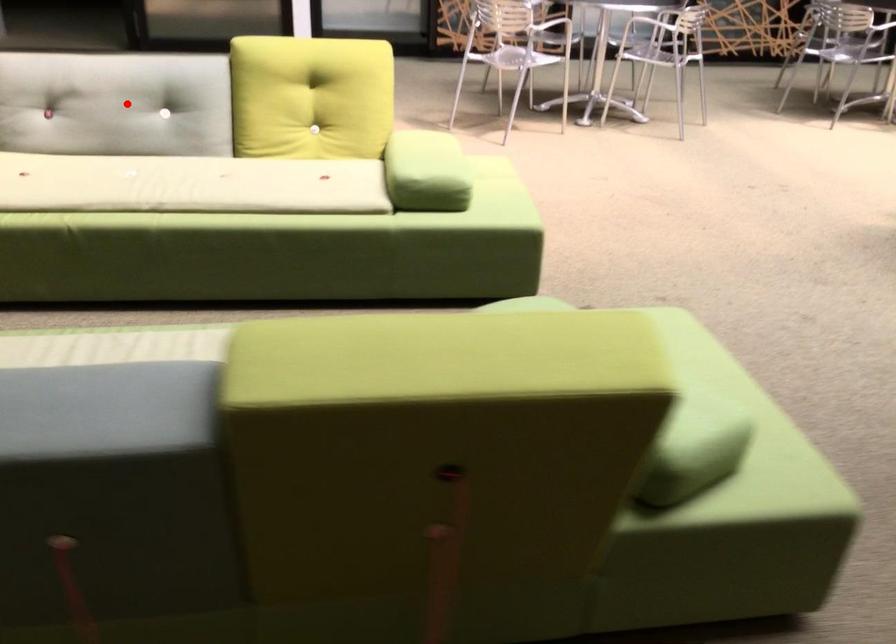
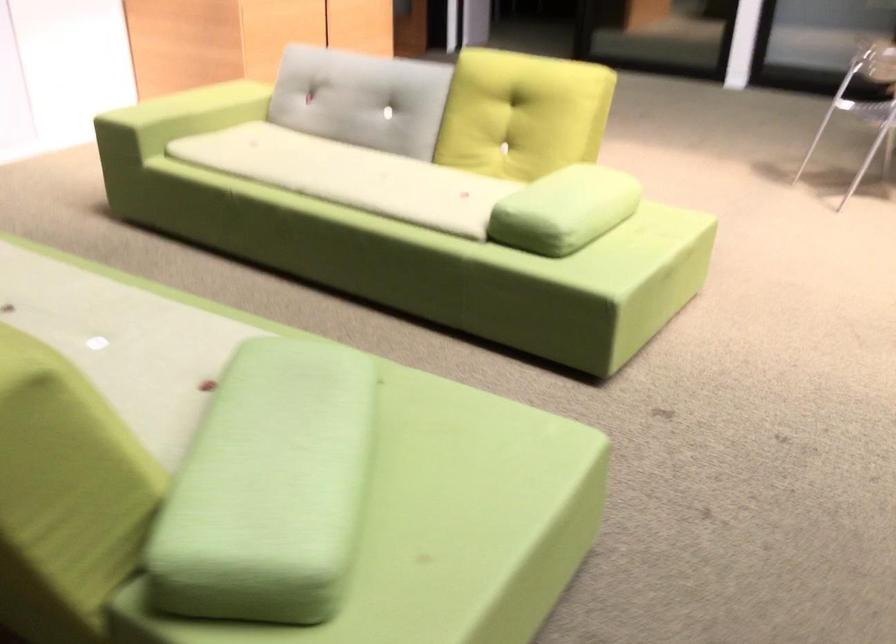
In the second image, find the point that corresponds to the highlighted location in the first image.

(362, 99)